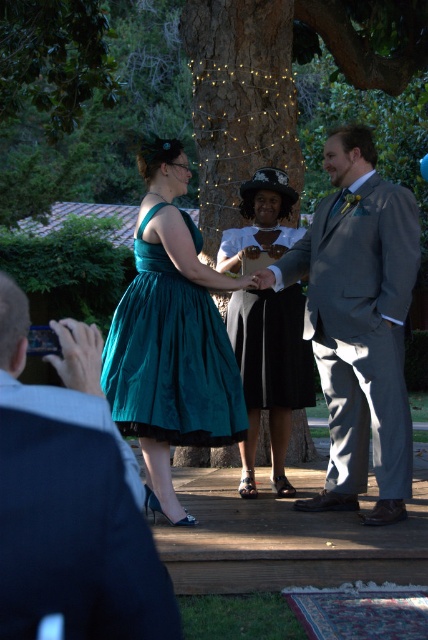
You are standing at the edge of the wooden platform where the wedding ceremony is taking place. You need to locate the man wearing the gray suit at center. According to the coordinates provided, where exactly should you look to find him?

The gray suit at center is located at point coordinates of 0.506 on the x axis and 0.839 on the y axis.

You are a photographer at a wedding ceremony. You need to capture a closeup shot of both the teal satin dress at center and the velvet teal dress at center in the same frame. The camera you are using has a maximum focus range of 24 inches. Can you fit both dresses in the frame without moving the camera?

The teal satin dress at center is 24.21 inches from the velvet teal dress at center. Since the distance between them exceeds the camera maximum focus range of 24 inches, you cannot fit both dresses in the frame without moving the camera.

From the picture: You are a photographer at a wedding ceremony. You need to adjust the camera focus to capture both the gray suit at center and the velvet teal dress at center clearly. Based on their positions, which one should you focus on first to ensure both are in focus?

The gray suit at center is located above the velvet teal dress at center. To ensure both are in focus, you should focus on the gray suit at center first since it is closer to the camera, and then adjust for the velvet teal dress at center if needed.